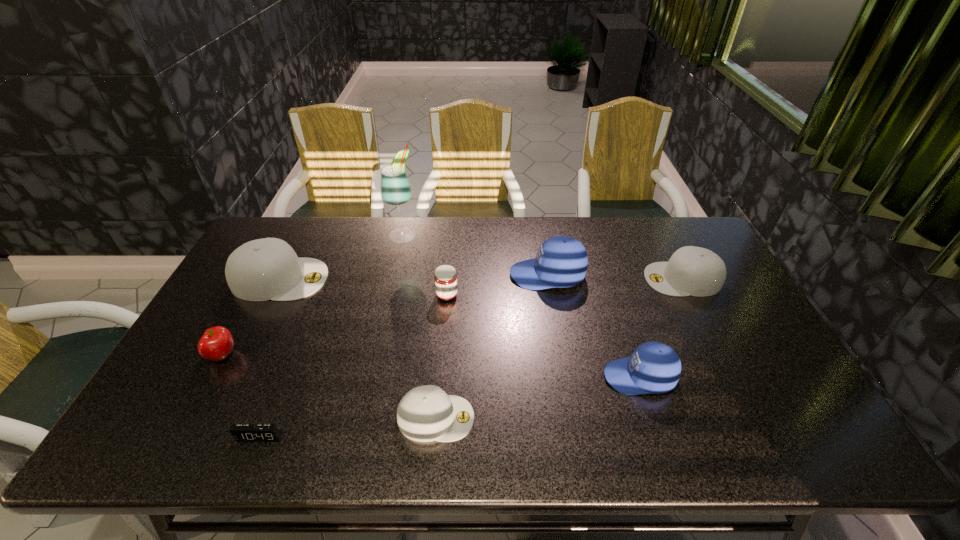
The image size is (960, 540). What are the coordinates of `cap situated at the left edge` in the screenshot? It's located at (264, 269).

Where is `apple positioned at the left edge`? This screenshot has height=540, width=960. apple positioned at the left edge is located at coordinates (216, 344).

You are a GUI agent. You are given a task and a screenshot of the screen. Output one action in this format:
    pyautogui.click(x=<x>, y=<y>)
    Task: Click on the object at the right edge
    This screenshot has width=960, height=540.
    Given the screenshot: What is the action you would take?
    [696, 271]

Find the location of a particular element. The height and width of the screenshot is (540, 960). vacant region at the far edge of the desktop is located at coordinates (304, 255).

Find the location of a particular element. The image size is (960, 540). free spot at the near edge of the desktop is located at coordinates (400, 454).

Find the location of `vacant space at the right edge of the desktop`. vacant space at the right edge of the desktop is located at coordinates (777, 368).

Locate an element on the screen. This screenshot has height=540, width=960. vacant space at the near left corner of the desktop is located at coordinates (147, 430).

The image size is (960, 540). In order to click on vacant space at the far right corner of the desktop in this screenshot , I will do `click(678, 231)`.

This screenshot has height=540, width=960. In order to click on free spot between the rightmost gray cap and the leftmost gray cap in this screenshot , I will do 481,279.

At what (x,y) coordinates should I click in order to perform the action: click on blank region between the second shortest object and the alcohol. Please return your answer as a coordinate pair (x, y). This screenshot has height=540, width=960. Looking at the image, I should click on pyautogui.click(x=420, y=326).